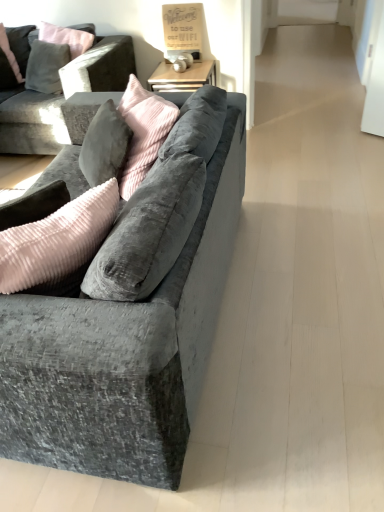
Question: From the image's perspective, would you say velvet grey couch at left, the second studio couch viewed from the top, is shown under velvet grey couch at upper left, the second studio couch positioned from the front?

Choices:
 (A) yes
 (B) no

Answer: (A)

Question: Is velvet grey couch at left, placed as the 2th studio couch when sorted from back to front, bigger than velvet grey couch at upper left, placed as the 2th studio couch when sorted from bottom to top?

Choices:
 (A) yes
 (B) no

Answer: (A)

Question: Is velvet grey couch at left, placed as the 2th studio couch when sorted from back to front, touching velvet grey couch at upper left, placed as the 2th studio couch when sorted from bottom to top?

Choices:
 (A) no
 (B) yes

Answer: (A)

Question: Is velvet grey couch at left, the first studio couch from the bottom, at the left side of velvet grey couch at upper left, which is counted as the first studio couch, starting from the top?

Choices:
 (A) no
 (B) yes

Answer: (A)

Question: Considering the relative sizes of velvet grey couch at left, arranged as the first studio couch when viewed from the front, and velvet grey couch at upper left, which ranks as the 1th studio couch in back-to-front order, in the image provided, is velvet grey couch at left, arranged as the first studio couch when viewed from the front, smaller than velvet grey couch at upper left, which ranks as the 1th studio couch in back-to-front order,?

Choices:
 (A) yes
 (B) no

Answer: (B)

Question: Considering the positions of point (23, 67) and point (84, 118), is point (23, 67) closer or farther from the camera than point (84, 118)?

Choices:
 (A) farther
 (B) closer

Answer: (A)

Question: In terms of height, does velvet gray pillow at upper left look taller or shorter compared to velvet grey couch at upper left, the second studio couch positioned from the front?

Choices:
 (A) tall
 (B) short

Answer: (B)

Question: Is velvet gray pillow at upper left wider or thinner than velvet grey couch at upper left, placed as the 2th studio couch when sorted from bottom to top?

Choices:
 (A) thin
 (B) wide

Answer: (A)

Question: Considering the positions of velvet gray pillow at upper left and velvet grey couch at upper left, which is counted as the first studio couch, starting from the top, in the image, is velvet gray pillow at upper left bigger or smaller than velvet grey couch at upper left, which is counted as the first studio couch, starting from the top,?

Choices:
 (A) small
 (B) big

Answer: (A)

Question: In terms of width, does velvet grey couch at left, arranged as the first studio couch when viewed from the front, look wider or thinner when compared to velvet grey couch at upper left, placed as the 2th studio couch when sorted from bottom to top?

Choices:
 (A) wide
 (B) thin

Answer: (A)

Question: Considering the positions of velvet grey couch at left, the first studio couch from the bottom, and velvet grey couch at upper left, the second studio couch positioned from the front, in the image, is velvet grey couch at left, the first studio couch from the bottom, taller or shorter than velvet grey couch at upper left, the second studio couch positioned from the front,?

Choices:
 (A) short
 (B) tall

Answer: (A)

Question: Looking at the image, does velvet grey couch at left, the first studio couch from the bottom, seem bigger or smaller compared to velvet grey couch at upper left, which ranks as the 1th studio couch in back-to-front order?

Choices:
 (A) small
 (B) big

Answer: (B)

Question: Does point (142, 345) appear closer or farther from the camera than point (41, 104)?

Choices:
 (A) closer
 (B) farther

Answer: (A)

Question: In the image, is velvet gray pillow at upper left positioned in front of or behind velvet grey couch at left, arranged as the first studio couch when viewed from the front?

Choices:
 (A) behind
 (B) front

Answer: (A)

Question: In the image, is velvet gray pillow at upper left on the left side or the right side of velvet grey couch at left, arranged as the first studio couch when viewed from the front?

Choices:
 (A) right
 (B) left

Answer: (B)